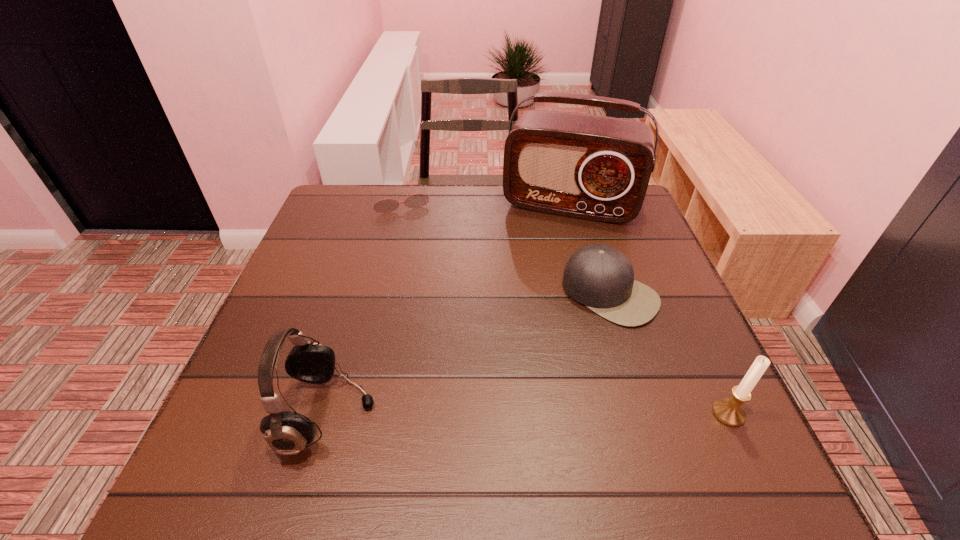
You are a GUI agent. You are given a task and a screenshot of the screen. Output one action in this format:
    pyautogui.click(x=<x>, y=<y>)
    Task: Click on the vacant point located between the fourth shortest object and the shortest object
    
    Given the screenshot: What is the action you would take?
    pyautogui.click(x=364, y=307)

Where is `empty space between the sunglasses and the fourth shortest object`? The height and width of the screenshot is (540, 960). empty space between the sunglasses and the fourth shortest object is located at coordinates (364, 307).

Identify the location of object that is the second closest to the tallest object. This screenshot has height=540, width=960. (417, 200).

Where is `object that can be found as the closest to the tallest object`? The image size is (960, 540). object that can be found as the closest to the tallest object is located at coordinates (600, 277).

Where is `vacant position in the image that satisfies the following two spatial constraints: 1. on the front side of the third shortest object; 2. on the right side of the radio receiver`? The height and width of the screenshot is (540, 960). vacant position in the image that satisfies the following two spatial constraints: 1. on the front side of the third shortest object; 2. on the right side of the radio receiver is located at coordinates (627, 414).